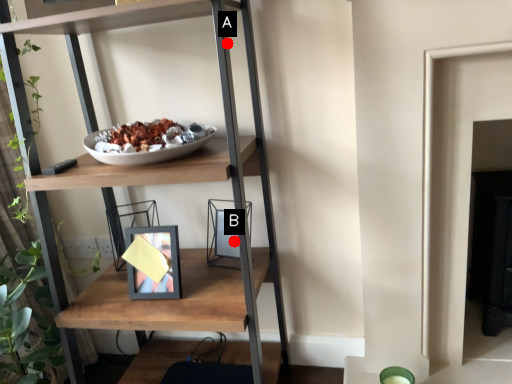
Question: Two points are circled on the image, labeled by A and B beside each circle. Among these points, which one is farthest from the camera?

Choices:
 (A) A is further
 (B) B is further

Answer: (B)